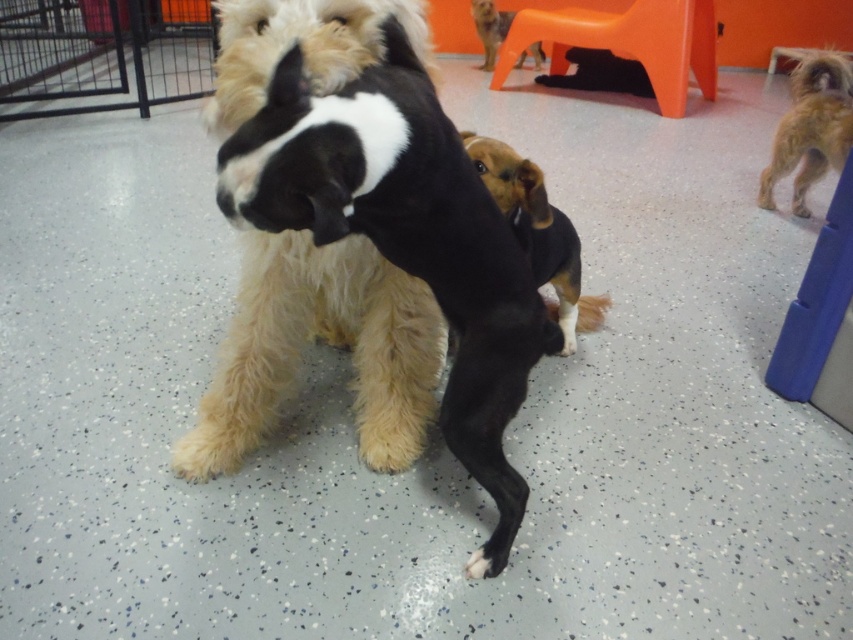
Between black and white fur at center and brown furry dog at upper center, which one appears on the right side from the viewer's perspective?

brown furry dog at upper center

Which is below, black and white fur at center or brown furry dog at upper center?

black and white fur at center is lower down.

You are a GUI agent. You are given a task and a screenshot of the screen. Output one action in this format:
    pyautogui.click(x=<x>, y=<y>)
    Task: Click on the black and white fur at center
    
    Given the screenshot: What is the action you would take?
    pyautogui.click(x=404, y=232)

Can you confirm if shaggy golden dog at right is positioned to the left of white fur at lower center?

In fact, shaggy golden dog at right is to the right of white fur at lower center.

The image size is (853, 640). I want to click on shaggy golden dog at right, so click(810, 125).

Describe the element at coordinates (810, 125) in the screenshot. The height and width of the screenshot is (640, 853). I see `shaggy golden dog at right` at that location.

This screenshot has width=853, height=640. I want to click on shaggy golden dog at right, so click(x=810, y=125).

Which is above, black and white fur at center or brown furry dog at center?

brown furry dog at center

Find the location of a particular element. The image size is (853, 640). black and white fur at center is located at coordinates (404, 232).